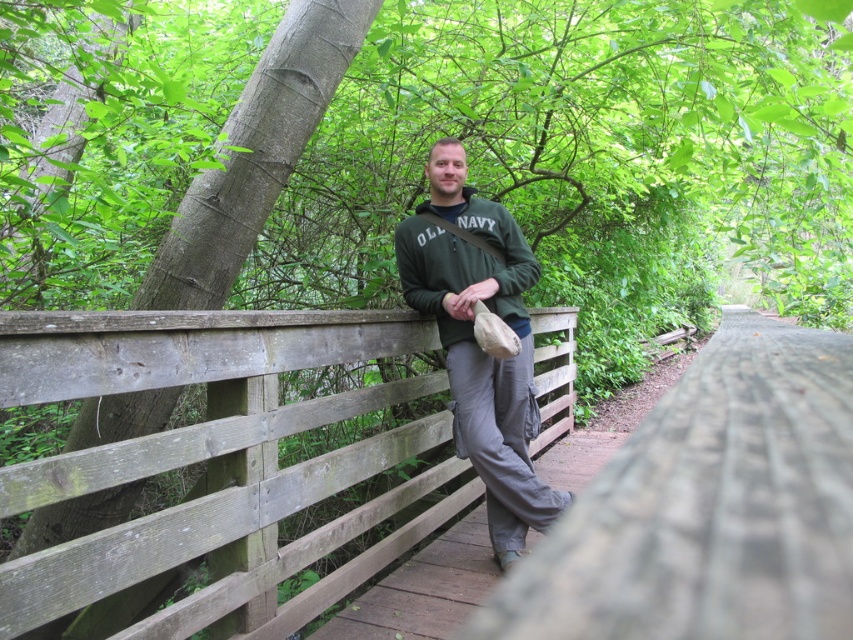
Question: Which of the following is the closest to the observer?

Choices:
 (A) (753, 568)
 (B) (442, 266)

Answer: (A)

Question: Which object appears farthest from the camera in this image?

Choices:
 (A) brown wooden path at center
 (B) wooden fence at center

Answer: (A)

Question: From the image, what is the correct spatial relationship of dark green fleece at center in relation to brown wooden path at center?

Choices:
 (A) below
 (B) above

Answer: (B)

Question: Which point appears closest to the camera in this image?

Choices:
 (A) (509, 534)
 (B) (780, 508)
 (C) (459, 208)
 (D) (440, 620)

Answer: (B)

Question: Is wooden fence at center bigger than dark green fleece at center?

Choices:
 (A) no
 (B) yes

Answer: (B)

Question: Where is dark green fleece at center located in relation to brown wooden path at center in the image?

Choices:
 (A) right
 (B) left

Answer: (A)